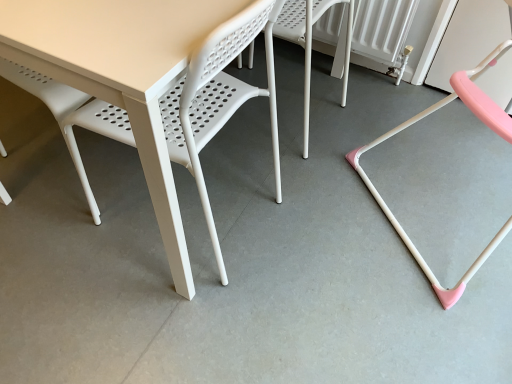
Question: Can you confirm if pink plastic chair at right, the first chair when ordered from right to left, is thinner than white plastic chair at center, the 1th chair when ordered from left to right?

Choices:
 (A) no
 (B) yes

Answer: (A)

Question: Is the position of pink plastic chair at right, which is counted as the second chair, starting from the left, more distant than that of white plastic chair at center, the 1th chair when ordered from left to right?

Choices:
 (A) no
 (B) yes

Answer: (A)

Question: Is pink plastic chair at right, which is counted as the second chair, starting from the left, smaller than white plastic chair at center, the 1th chair when ordered from left to right?

Choices:
 (A) yes
 (B) no

Answer: (B)

Question: Is pink plastic chair at right, the first chair when ordered from right to left, completely or partially outside of white plastic chair at center, the second chair viewed from the right?

Choices:
 (A) no
 (B) yes

Answer: (B)

Question: Is pink plastic chair at right, the first chair when ordered from right to left, positioned before white plastic chair at center, the second chair viewed from the right?

Choices:
 (A) no
 (B) yes

Answer: (B)

Question: Does point (168, 61) appear closer or farther from the camera than point (345, 66)?

Choices:
 (A) closer
 (B) farther

Answer: (A)

Question: In the image, is white plastic table at center positioned in front of or behind white plastic chair at center, the 1th chair when ordered from left to right?

Choices:
 (A) behind
 (B) front

Answer: (B)

Question: From a real-world perspective, relative to white plastic chair at center, the 1th chair when ordered from left to right, is white plastic table at center vertically above or below?

Choices:
 (A) above
 (B) below

Answer: (A)

Question: Considering the positions of white plastic table at center and white plastic chair at center, the second chair viewed from the right, in the image, is white plastic table at center wider or thinner than white plastic chair at center, the second chair viewed from the right,?

Choices:
 (A) thin
 (B) wide

Answer: (B)

Question: Based on their sizes in the image, would you say pink plastic chair at right, which is counted as the second chair, starting from the left, is bigger or smaller than white plastic table at center?

Choices:
 (A) small
 (B) big

Answer: (B)

Question: Does point (488, 104) appear closer or farther from the camera than point (152, 155)?

Choices:
 (A) closer
 (B) farther

Answer: (B)

Question: From their relative heights in the image, would you say pink plastic chair at right, which is counted as the second chair, starting from the left, is taller or shorter than white plastic table at center?

Choices:
 (A) short
 (B) tall

Answer: (A)

Question: Considering the positions of pink plastic chair at right, the first chair when ordered from right to left, and white plastic table at center in the image, is pink plastic chair at right, the first chair when ordered from right to left, wider or thinner than white plastic table at center?

Choices:
 (A) wide
 (B) thin

Answer: (A)

Question: From a real-world perspective, relative to pink plastic chair at right, the first chair when ordered from right to left, is white plastic table at center vertically above or below?

Choices:
 (A) below
 (B) above

Answer: (B)

Question: Looking at their shapes, would you say white plastic table at center is wider or thinner than pink plastic chair at right, the first chair when ordered from right to left?

Choices:
 (A) thin
 (B) wide

Answer: (A)